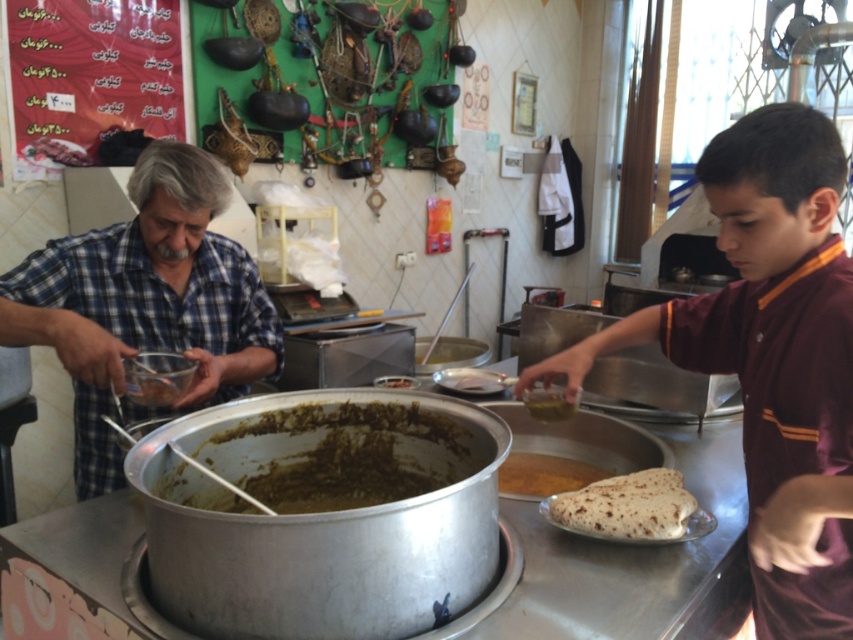
Question: Observing the image, what is the correct spatial positioning of blue plaid shirt at left in reference to brown matte bowl at center?

Choices:
 (A) above
 (B) below

Answer: (A)

Question: Is brown matte flatbread at center wider than green matte oil at center?

Choices:
 (A) no
 (B) yes

Answer: (B)

Question: Which object is closer to the camera taking this photo?

Choices:
 (A) brown matte flatbread at lower right
 (B) brown matte bowl at center
 (C) green matte oil at center

Answer: (C)

Question: Is blue plaid shirt at left below greenish-brown paste at center?

Choices:
 (A) no
 (B) yes

Answer: (A)

Question: Which point appears closest to the camera in this image?

Choices:
 (A) (32, 324)
 (B) (207, 445)
 (C) (642, 499)

Answer: (C)

Question: Among these points, which one is farthest from the camera?

Choices:
 (A) (67, 278)
 (B) (735, 253)

Answer: (A)